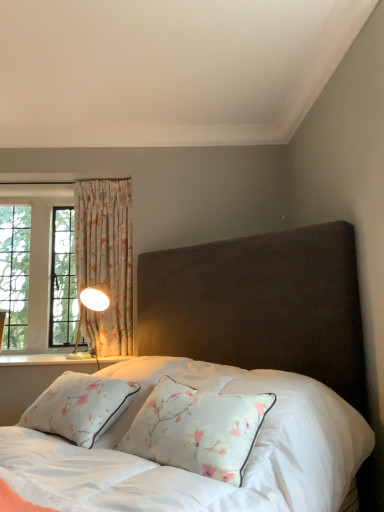
What do you see at coordinates (42, 360) in the screenshot? I see `white painted wood at lower left` at bounding box center [42, 360].

At what (x,y) coordinates should I click in order to perform the action: click on velvet dark brown bed at center. Please return your answer as a coordinate pair (x, y). The height and width of the screenshot is (512, 384). Looking at the image, I should click on (261, 305).

Locate an element on the screen. This screenshot has height=512, width=384. white painted wood at lower left is located at coordinates (42, 360).

Is floral fabric curtain at left located within velvet dark brown bed at center?

No, floral fabric curtain at left is located outside of velvet dark brown bed at center.

In terms of size, does velvet dark brown bed at center appear bigger or smaller than floral fabric curtain at left?

velvet dark brown bed at center is bigger than floral fabric curtain at left.

Are velvet dark brown bed at center and floral fabric curtain at left far apart?

That's not correct — velvet dark brown bed at center is a little close to floral fabric curtain at left.

Does point (186, 330) lie behind point (129, 285)?

No, it is not.

In order to click on curtain above the metallic gold table lamp at left (from the image's perspective) in this screenshot , I will do `click(106, 261)`.

Consider the image. Is floral fabric curtain at left positioned far away from metallic gold table lamp at left?

Actually, floral fabric curtain at left and metallic gold table lamp at left are a little close together.

Is point (131, 262) in front of point (79, 358)?

No, (131, 262) is behind (79, 358).

From the picture: Which is correct: white painted wood at lower left is inside floral fabric curtain at left, or outside of it?

white painted wood at lower left is not enclosed by floral fabric curtain at left.

Locate an element on the screen. The height and width of the screenshot is (512, 384). window sill to the left of floral fabric curtain at left is located at coordinates (42, 360).

Can you confirm if white painted wood at lower left is shorter than floral fabric curtain at left?

Yes.

Is white painted wood at lower left closer to the viewer compared to floral fabric curtain at left?

Yes, white painted wood at lower left is in front of floral fabric curtain at left.

Who is bigger, floral fabric curtain at left or white painted wood at lower left?

With larger size is floral fabric curtain at left.

How many degrees apart are the facing directions of floral fabric curtain at left and white painted wood at lower left?

The facing directions of floral fabric curtain at left and white painted wood at lower left are 0.00219 degrees apart.

Would you say floral fabric curtain at left is inside or outside white painted wood at lower left?

floral fabric curtain at left is spatially situated outside white painted wood at lower left.

In the scene shown: Between floral fabric curtain at left and white painted wood at lower left, which one has more height?

Standing taller between the two is floral fabric curtain at left.

Is point (170, 269) closer to camera compared to point (86, 305)?

Yes, it is.

Considering the sizes of velvet dark brown bed at center and metallic gold table lamp at left in the image, is velvet dark brown bed at center taller or shorter than metallic gold table lamp at left?

Considering their sizes, velvet dark brown bed at center has more height than metallic gold table lamp at left.

Find the location of `table lamp to the left of velvet dark brown bed at center`. table lamp to the left of velvet dark brown bed at center is located at coordinates (91, 310).

Is velvet dark brown bed at center in front of or behind white painted wood at lower left in the image?

Visually, velvet dark brown bed at center is located in front of white painted wood at lower left.

Considering the sizes of objects velvet dark brown bed at center and white painted wood at lower left in the image provided, who is shorter, velvet dark brown bed at center or white painted wood at lower left?

With less height is white painted wood at lower left.

Is velvet dark brown bed at center outside of white painted wood at lower left?

Yes, velvet dark brown bed at center is located beyond the bounds of white painted wood at lower left.

Which of these two, white painted wood at lower left or velvet dark brown bed at center, stands taller?

velvet dark brown bed at center.

Image resolution: width=384 pixels, height=512 pixels. Find the location of `bed located underneath the white painted wood at lower left (from a real-world perspective)`. bed located underneath the white painted wood at lower left (from a real-world perspective) is located at coordinates (261, 305).

Considering the relative sizes of white painted wood at lower left and velvet dark brown bed at center in the image provided, is white painted wood at lower left thinner than velvet dark brown bed at center?

Yes, white painted wood at lower left is thinner than velvet dark brown bed at center.

Identify the location of curtain located on the left of velvet dark brown bed at center. (106, 261).

This screenshot has height=512, width=384. What are the coordinates of `curtain above the metallic gold table lamp at left (from the image's perspective)` in the screenshot? It's located at (106, 261).

Based on the photo, considering their positions, is velvet dark brown bed at center positioned closer to floral fabric curtain at left than metallic gold table lamp at left?

metallic gold table lamp at left lies closer to floral fabric curtain at left than the other object.

Looking at the image, which one is located closer to floral fabric curtain at left, white painted wood at lower left or metallic gold table lamp at left?

Among the two, metallic gold table lamp at left is located nearer to floral fabric curtain at left.

From the image, which object appears to be nearer to velvet dark brown bed at center, floral fabric curtain at left or metallic gold table lamp at left?

floral fabric curtain at left lies closer to velvet dark brown bed at center than the other object.

Which object lies further to the anchor point velvet dark brown bed at center, metallic gold table lamp at left or floral fabric curtain at left?

The object further to velvet dark brown bed at center is metallic gold table lamp at left.

Which object lies further to the anchor point floral fabric curtain at left, metallic gold table lamp at left or white painted wood at lower left?

white painted wood at lower left is further to floral fabric curtain at left.

Based on their spatial positions, is metallic gold table lamp at left or floral fabric curtain at left closer to white painted wood at lower left?

Based on the image, metallic gold table lamp at left appears to be nearer to white painted wood at lower left.

Looking at the image, which one is located further to velvet dark brown bed at center, white painted wood at lower left or metallic gold table lamp at left?

Based on the image, white painted wood at lower left appears to be further to velvet dark brown bed at center.

Looking at the image, which one is located closer to metallic gold table lamp at left, white painted wood at lower left or floral fabric curtain at left?

floral fabric curtain at left is closer to metallic gold table lamp at left.

In order to click on table lamp between velvet dark brown bed at center and white painted wood at lower left along the z-axis in this screenshot , I will do `click(91, 310)`.

Where is `table lamp between floral fabric curtain at left and white painted wood at lower left vertically`? The image size is (384, 512). table lamp between floral fabric curtain at left and white painted wood at lower left vertically is located at coordinates (91, 310).

Where is `window sill between velvet dark brown bed at center and floral fabric curtain at left along the z-axis`? window sill between velvet dark brown bed at center and floral fabric curtain at left along the z-axis is located at coordinates (42, 360).

Identify the location of table lamp positioned between velvet dark brown bed at center and floral fabric curtain at left from near to far. (91, 310).